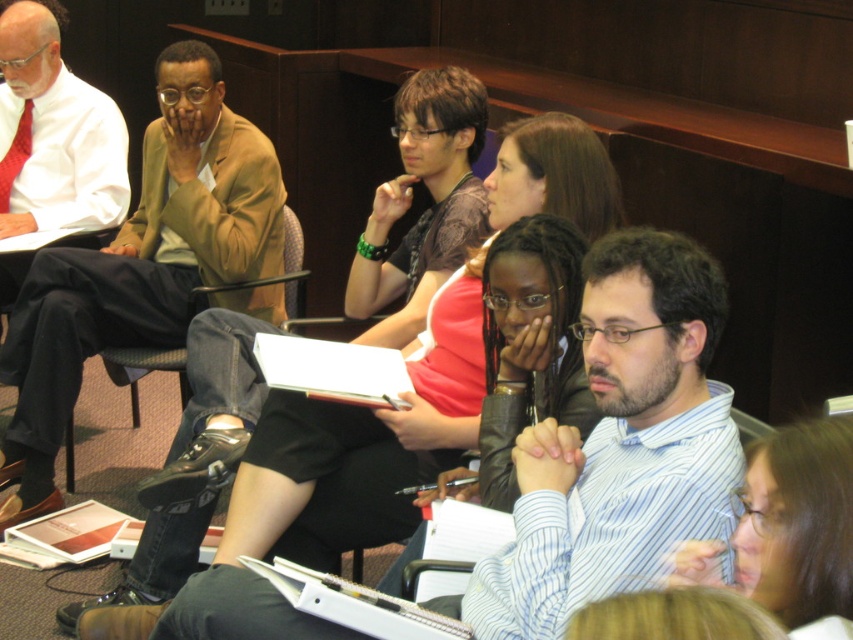
Question: Does striped cotton shirt at center have a lesser width compared to blue striped shirt at center?

Choices:
 (A) yes
 (B) no

Answer: (B)

Question: Among these points, which one is farthest from the camera?

Choices:
 (A) (149, 268)
 (B) (103, 349)
 (C) (610, 262)

Answer: (A)

Question: Among these points, which one is farthest from the camera?

Choices:
 (A) (202, 90)
 (B) (645, 392)
 (C) (680, 285)

Answer: (A)

Question: Does blue striped shirt at center have a larger size compared to black leather chair at center?

Choices:
 (A) no
 (B) yes

Answer: (A)

Question: Which point is farther to the camera?

Choices:
 (A) (646, 388)
 (B) (618, 458)
 (C) (54, 321)
 (D) (125, 364)

Answer: (D)

Question: Considering the relative positions of blue striped shirt at center and light brown leather jacket at upper left in the image provided, where is blue striped shirt at center located with respect to light brown leather jacket at upper left?

Choices:
 (A) below
 (B) above

Answer: (A)